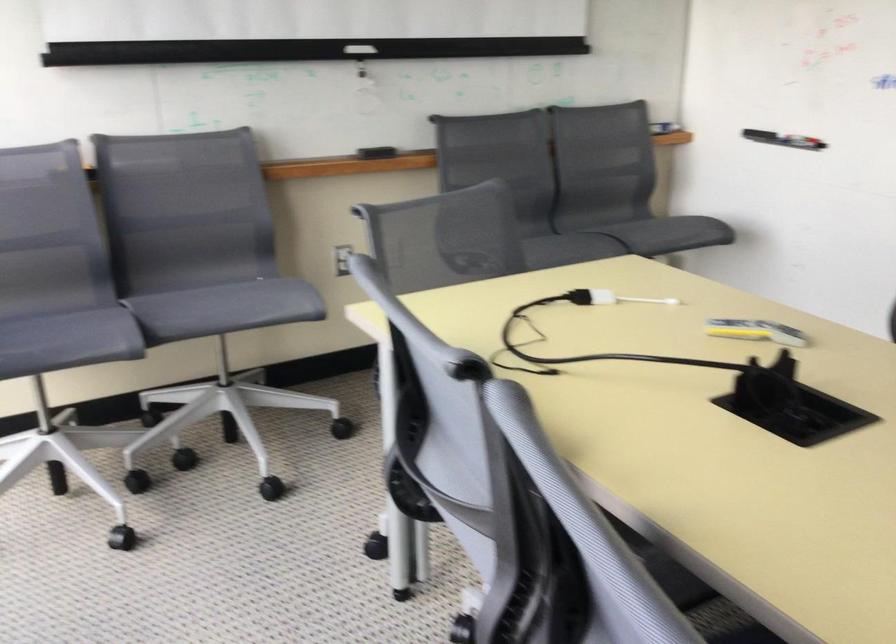
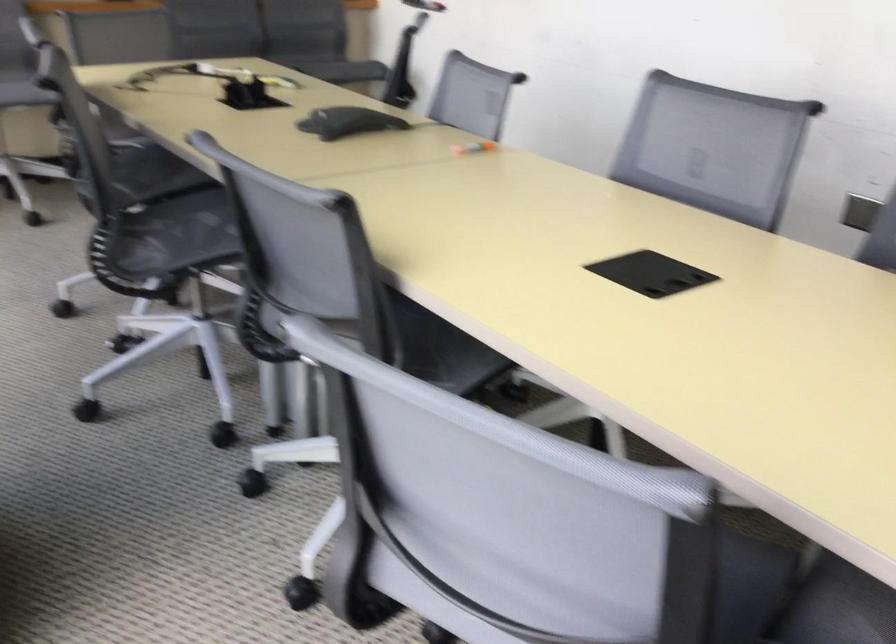
Question: I am providing you with two images of the same scene from different viewpoints. After the viewpoint changes to image2, which objects are now occluded?

Choices:
 (A) wooden candlestick holder
 (B) black conference phone
 (C) chair sitting surface
 (D) orange marker

Answer: (C)